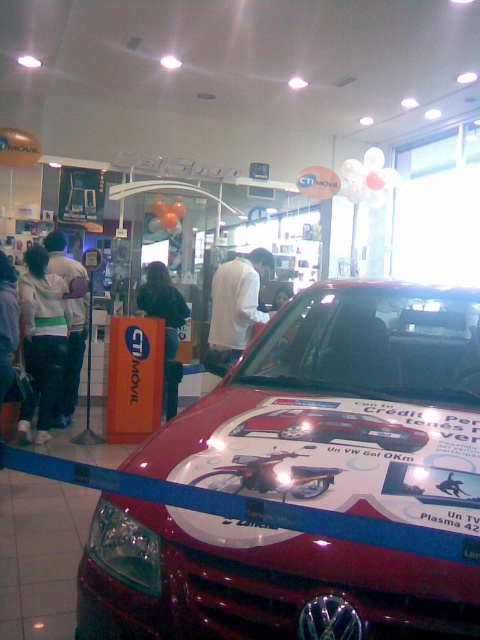
Can you confirm if white matte shirt at center is positioned above white hoodie at center?

Correct, white matte shirt at center is located above white hoodie at center.

Can you confirm if white matte shirt at center is positioned below white hoodie at center?

Actually, white matte shirt at center is above white hoodie at center.

The height and width of the screenshot is (640, 480). I want to click on white matte shirt at center, so [x=235, y=307].

Who is shorter, dark fabric jacket at center or dark gray hoodie at left?

dark gray hoodie at left is shorter.

Who is more forward, (155, 272) or (8, 324)?

Point (8, 324)

Who is more forward, (162,291) or (1,257)?

Point (1,257)

Where is `dark fabric jacket at center`? The width and height of the screenshot is (480, 640). dark fabric jacket at center is located at coordinates 163,310.

Is white fleece jacket at left to the left of white hoodie at center from the viewer's perspective?

Indeed, white fleece jacket at left is positioned on the left side of white hoodie at center.

Does white fleece jacket at left have a greater height compared to white hoodie at center?

Indeed, white fleece jacket at left has a greater height compared to white hoodie at center.

The width and height of the screenshot is (480, 640). What do you see at coordinates (41, 340) in the screenshot? I see `white fleece jacket at left` at bounding box center [41, 340].

The image size is (480, 640). In order to click on white fleece jacket at left in this screenshot , I will do `click(41, 340)`.